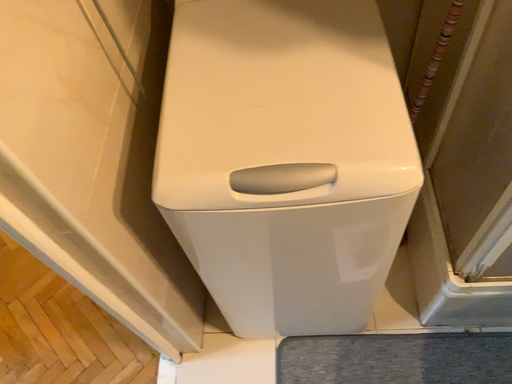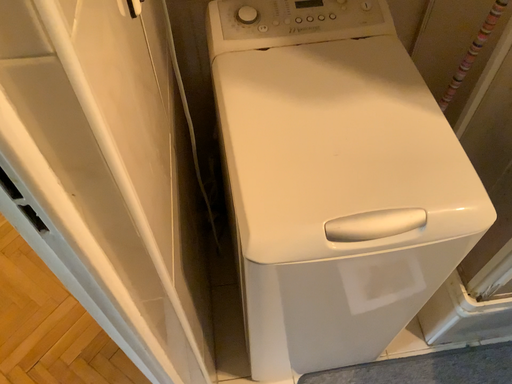
Question: How did the camera likely rotate when shooting the video?

Choices:
 (A) rotated left
 (B) rotated right

Answer: (B)